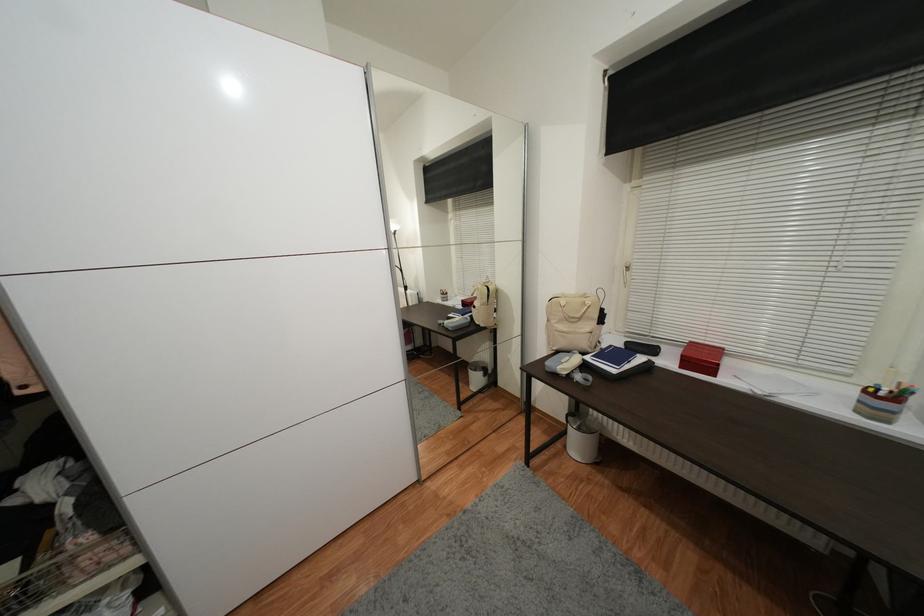
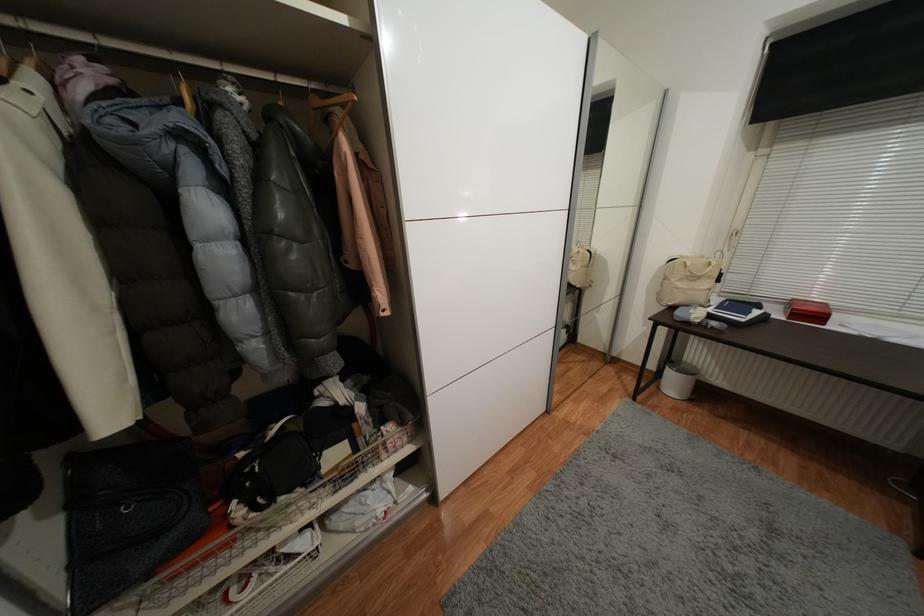
Where in the second image is the point corresponding to (569,448) from the first image?

(663, 390)